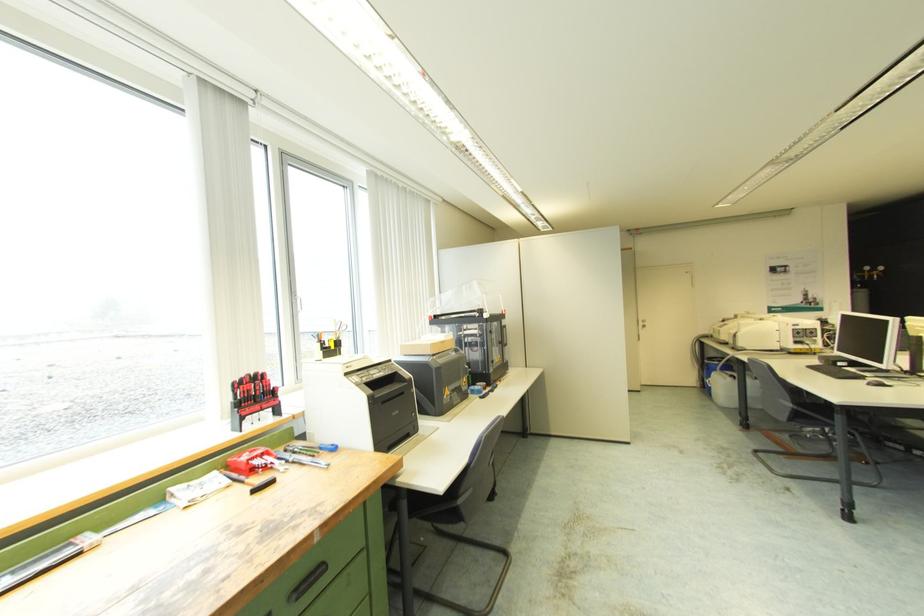
You are a GUI agent. You are given a task and a screenshot of the screen. Output one action in this format:
    pyautogui.click(x=<x>, y=<y>)
    Task: Click on the clear 3D printer cover
    This screenshot has height=616, width=924.
    Given the screenshot: What is the action you would take?
    pyautogui.click(x=359, y=403)